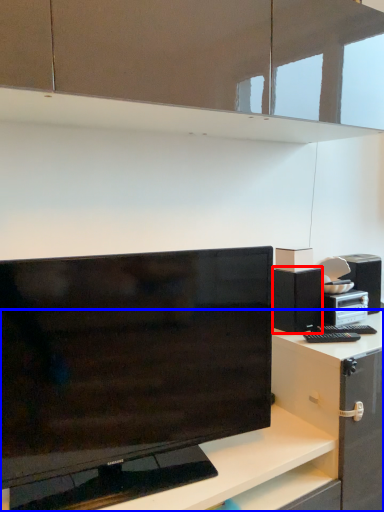
Question: Which object appears closest to the camera in this image, cabinetry (highlighted by a red box) or desk (highlighted by a blue box)?

Choices:
 (A) cabinetry
 (B) desk

Answer: (B)